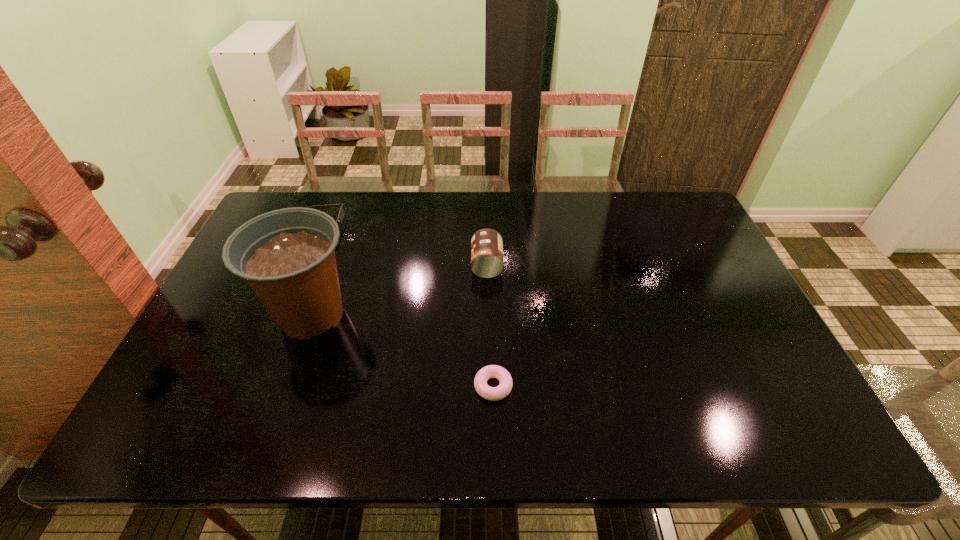
The width and height of the screenshot is (960, 540). In order to click on the third closest object to the farthest object in this screenshot , I will do `click(491, 371)`.

Where is `vacant area in the image that satisfies the following two spatial constraints: 1. on the back side of the shortest object; 2. on the front label of the third nearest object`? The height and width of the screenshot is (540, 960). vacant area in the image that satisfies the following two spatial constraints: 1. on the back side of the shortest object; 2. on the front label of the third nearest object is located at coordinates click(x=491, y=264).

This screenshot has width=960, height=540. Identify the location of free space that satisfies the following two spatial constraints: 1. on the front-facing side of the third tallest object; 2. on the left side of the tallest object. (282, 315).

Locate an element on the screen. vacant region that satisfies the following two spatial constraints: 1. on the front label of the can; 2. on the left side of the doughnut is located at coordinates (489, 386).

The width and height of the screenshot is (960, 540). What are the coordinates of `vacant space that satisfies the following two spatial constraints: 1. on the front-facing side of the third tallest object; 2. on the left side of the flowerpot` in the screenshot? It's located at (282, 315).

The height and width of the screenshot is (540, 960). Find the location of `vacant position in the image that satisfies the following two spatial constraints: 1. on the front-facing side of the spectacles; 2. on the back side of the shortest object`. vacant position in the image that satisfies the following two spatial constraints: 1. on the front-facing side of the spectacles; 2. on the back side of the shortest object is located at coordinates (252, 386).

At what (x,y) coordinates should I click in order to perform the action: click on vacant space that satisfies the following two spatial constraints: 1. on the front-facing side of the nearest object; 2. on the right side of the spectacles. Please return your answer as a coordinate pair (x, y). This screenshot has width=960, height=540. Looking at the image, I should click on (252, 386).

Locate an element on the screen. free space that satisfies the following two spatial constraints: 1. on the front-facing side of the flowerpot; 2. on the left side of the spectacles is located at coordinates (282, 315).

Locate an element on the screen. The height and width of the screenshot is (540, 960). free spot that satisfies the following two spatial constraints: 1. on the back side of the tallest object; 2. on the front-facing side of the farthest object is located at coordinates (343, 227).